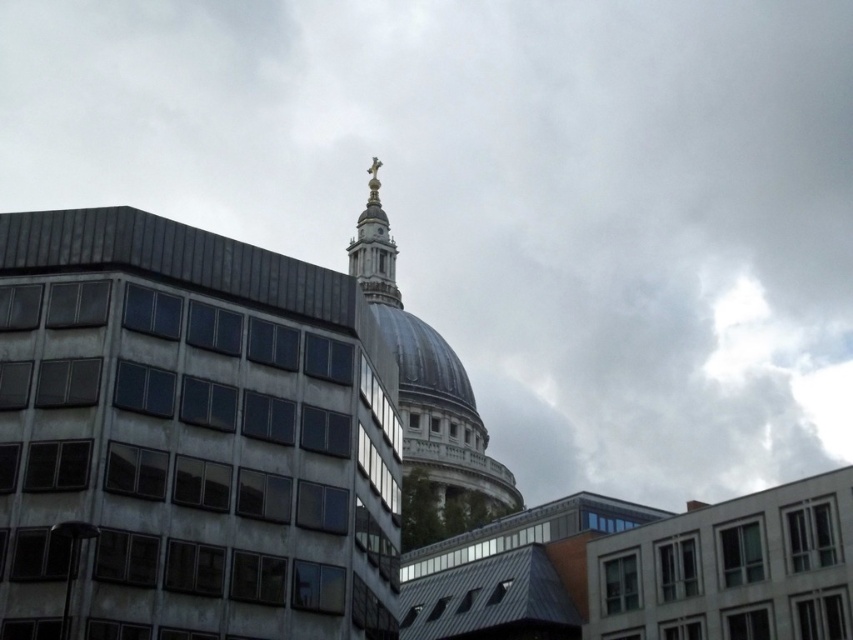
Question: Is white marble dome at center positioned behind gold polished metal spire at upper center?

Choices:
 (A) no
 (B) yes

Answer: (A)

Question: Which point is farther from the camera taking this photo?

Choices:
 (A) (376, 540)
 (B) (447, 346)

Answer: (B)

Question: Which object appears farthest from the camera in this image?

Choices:
 (A) white marble dome at center
 (B) gold polished metal spire at upper center

Answer: (B)

Question: Observing the image, what is the correct spatial positioning of white marble dome at center in reference to gold polished metal spire at upper center?

Choices:
 (A) below
 (B) above

Answer: (A)

Question: Which point is closer to the camera taking this photo?

Choices:
 (A) (401, 324)
 (B) (346, 611)
 (C) (397, 298)
 (D) (383, 296)

Answer: (B)

Question: Is gold metallic spire at upper center thinner than gold polished metal spire at upper center?

Choices:
 (A) yes
 (B) no

Answer: (B)